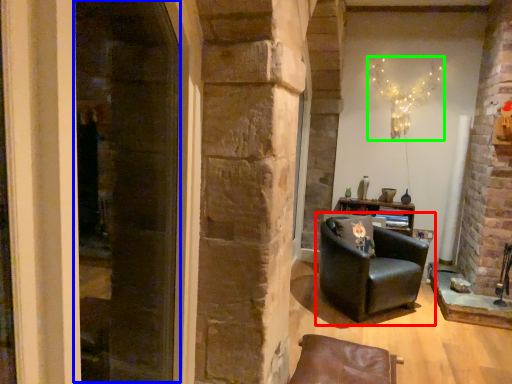
Question: Which object is the farthest from chair (highlighted by a red box)? Choose among these: screen door (highlighted by a blue box) or christmas light (highlighted by a green box).

Choices:
 (A) screen door
 (B) christmas light

Answer: (A)